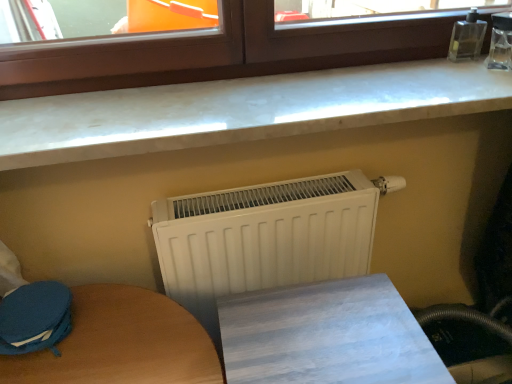
The height and width of the screenshot is (384, 512). What are the coordinates of `free space above wooden table at lower center (from a real-world perspective)` in the screenshot? It's located at (x=333, y=334).